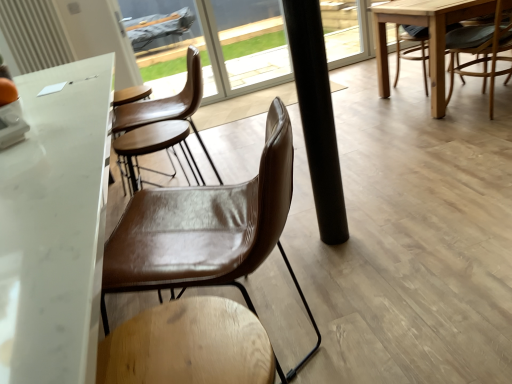
You are a GUI agent. You are given a task and a screenshot of the screen. Output one action in this format:
    pyautogui.click(x=<x>, y=<y>)
    Task: Click on the vacant area that lies between brown leather chair at center, which appears as the first chair when viewed from the left, and black matte pole at center
    Image resolution: width=512 pixels, height=384 pixels.
    Given the screenshot: What is the action you would take?
    [318, 287]